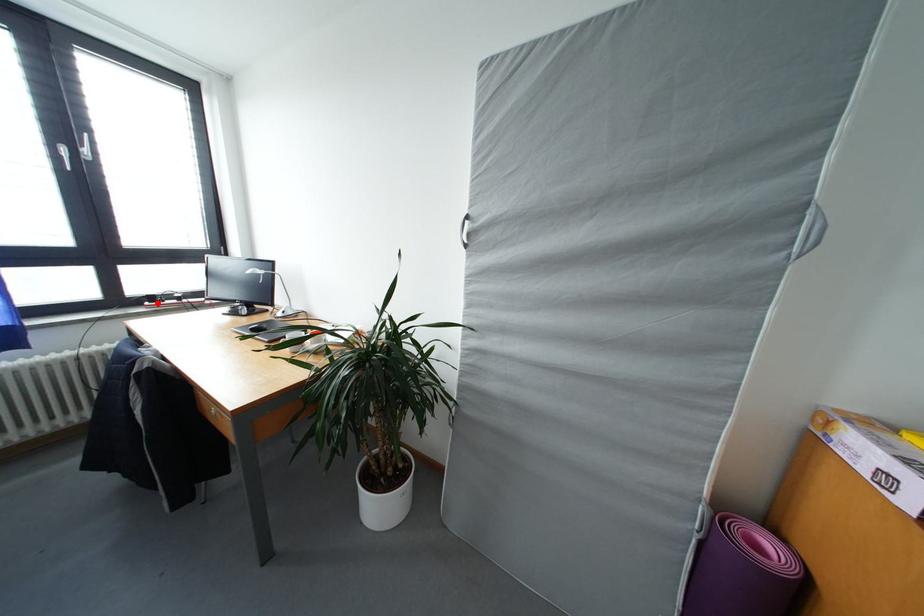
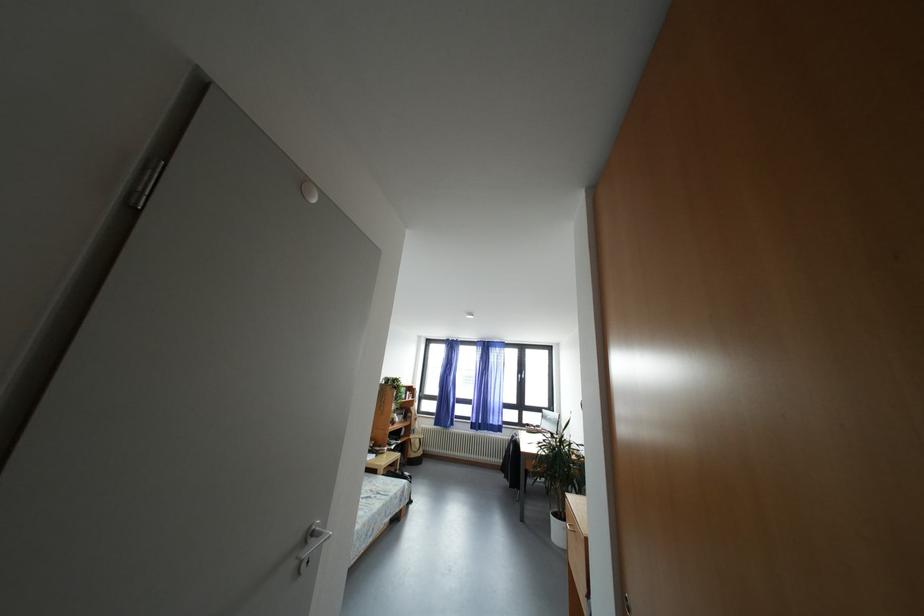
Question: I am providing you with two images of the same scene from different viewpoints. In image1, a red point is highlighted. Considering the same 3D point in image2, which of the following is correct?

Choices:
 (A) It is closer
 (B) It is farther

Answer: (B)